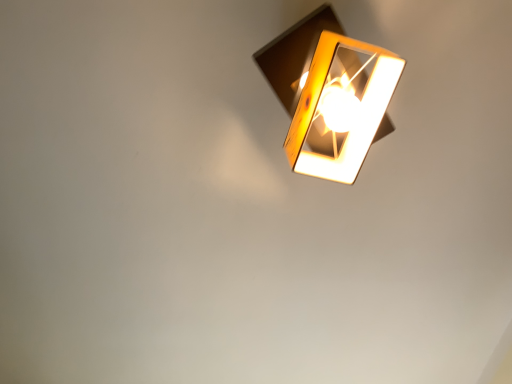
Describe the element at coordinates (330, 94) in the screenshot. Image resolution: width=512 pixels, height=384 pixels. I see `metallic gold lamp at upper center` at that location.

The image size is (512, 384). In order to click on metallic gold lamp at upper center in this screenshot , I will do `click(330, 94)`.

Locate an element on the screen. The height and width of the screenshot is (384, 512). metallic gold lamp at upper center is located at coordinates (330, 94).